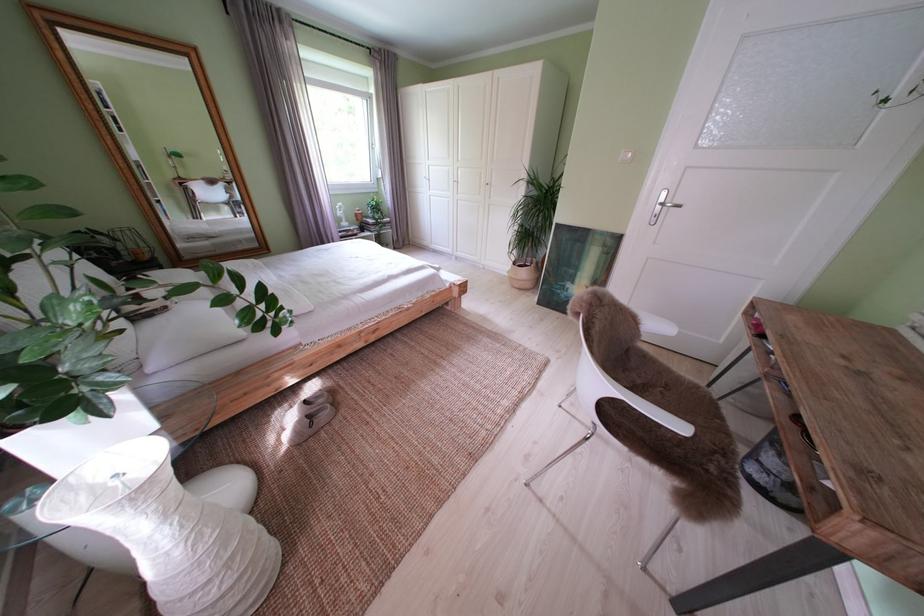
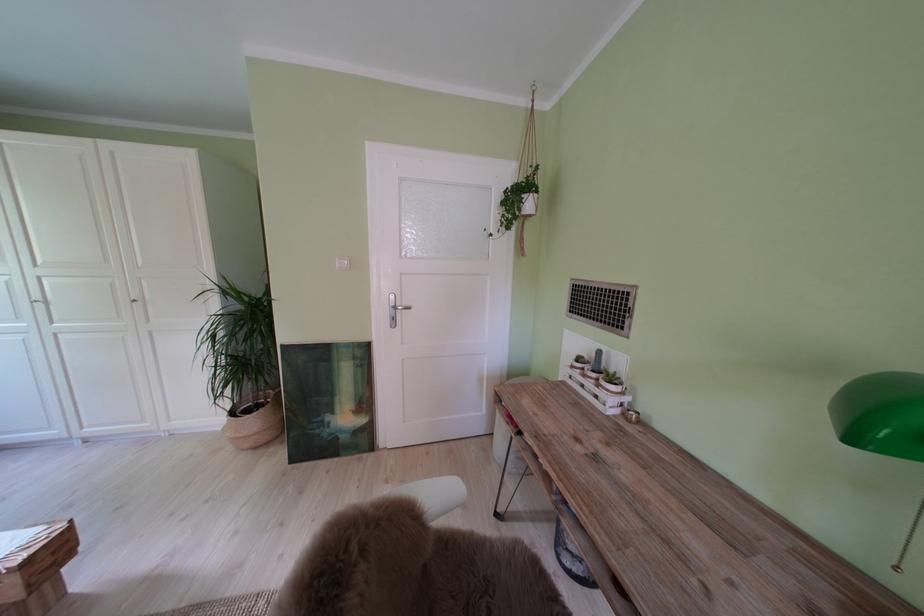
In the second image, find the point that corresponds to point 526,269 in the first image.

(242, 418)